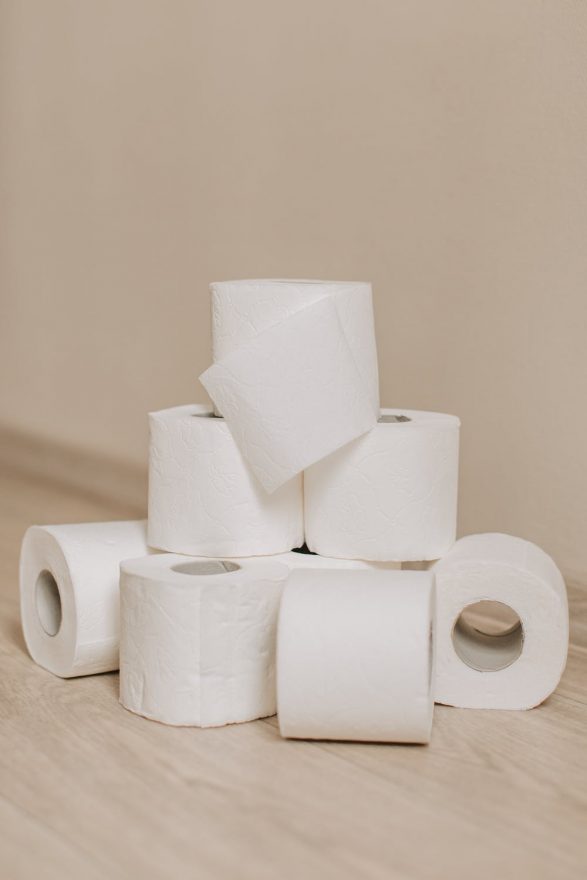
The image size is (587, 880). I want to click on toilet paper, so click(x=306, y=348), click(x=195, y=468), click(x=389, y=482), click(x=193, y=631), click(x=325, y=634), click(x=95, y=540), click(x=539, y=561).